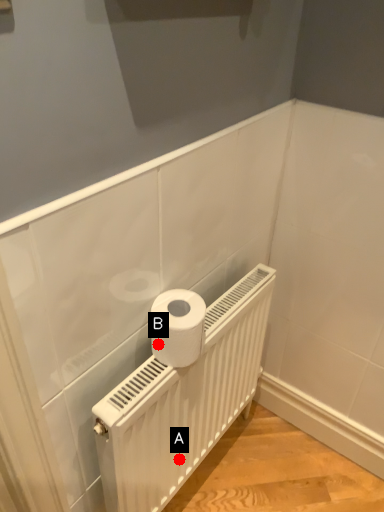
Question: Two points are circled on the image, labeled by A and B beside each circle. Which point is closer to the camera?

Choices:
 (A) A is closer
 (B) B is closer

Answer: (B)